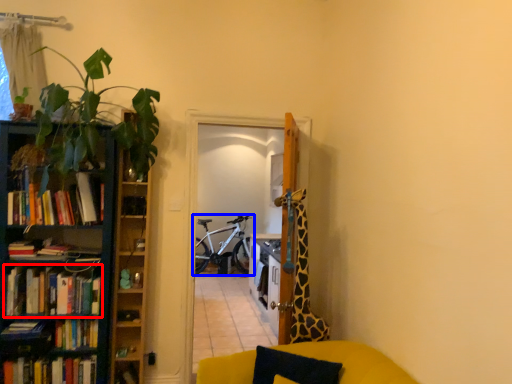
Question: Among these objects, which one is nearest to the camera, book (highlighted by a red box) or bicycle (highlighted by a blue box)?

Choices:
 (A) book
 (B) bicycle

Answer: (A)